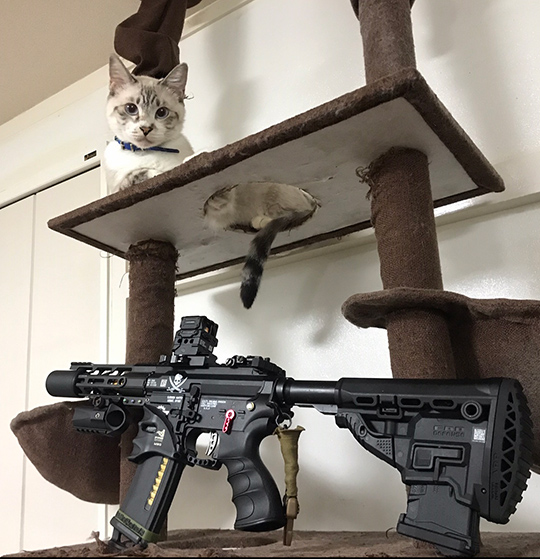
In order to click on handle in this screenshot , I will do `click(253, 473)`.